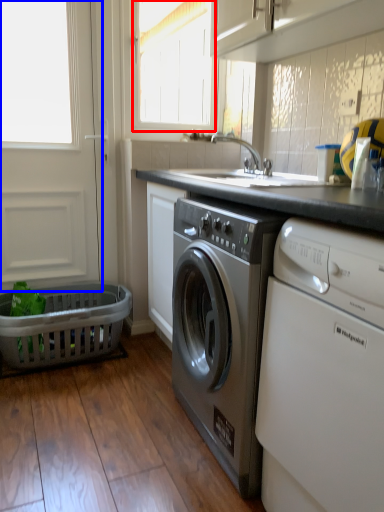
Question: Which point is further to the camera, window (highlighted by a red box) or screen door (highlighted by a blue box)?

Choices:
 (A) window
 (B) screen door

Answer: (A)